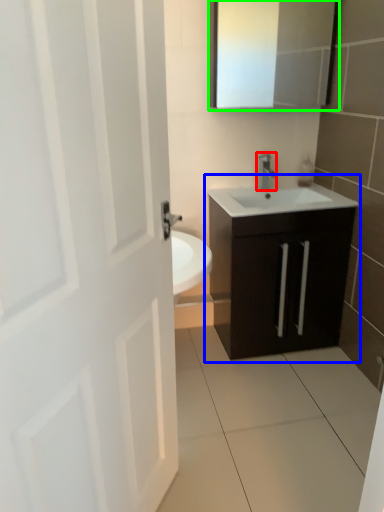
Question: Estimate the real-world distances between objects in this image. Which object is farther from tap (highlighted by a red box), bathroom cabinet (highlighted by a blue box) or medicine cabinet (highlighted by a green box)?

Choices:
 (A) bathroom cabinet
 (B) medicine cabinet

Answer: (B)